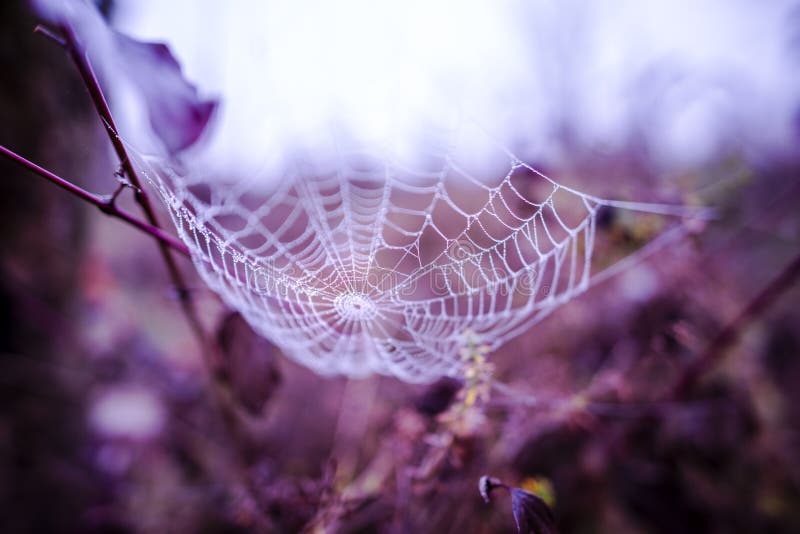
You are a GUI agent. You are given a task and a screenshot of the screen. Output one action in this format:
    pyautogui.click(x=<x>, y=<y>)
    Task: Click on the plant
    The image size is (800, 534).
    Given the screenshot: What is the action you would take?
    pyautogui.click(x=473, y=387)